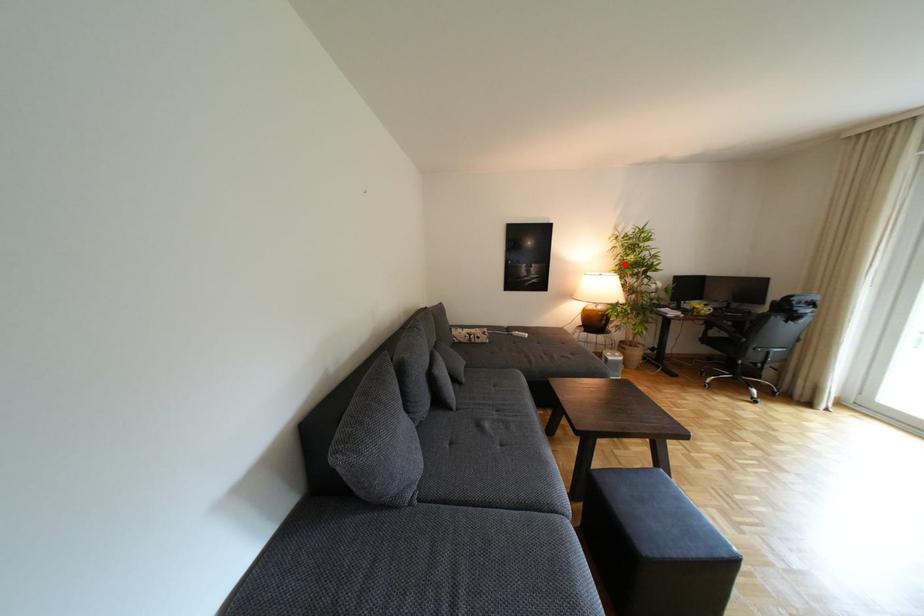
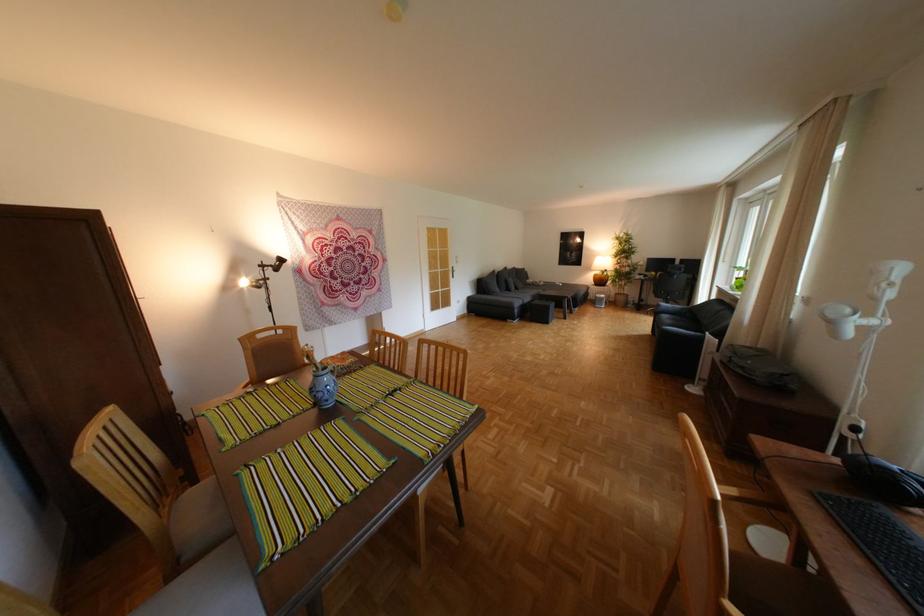
Locate, in the second image, the point that corresponds to the highlighted location in the first image.

(626, 252)